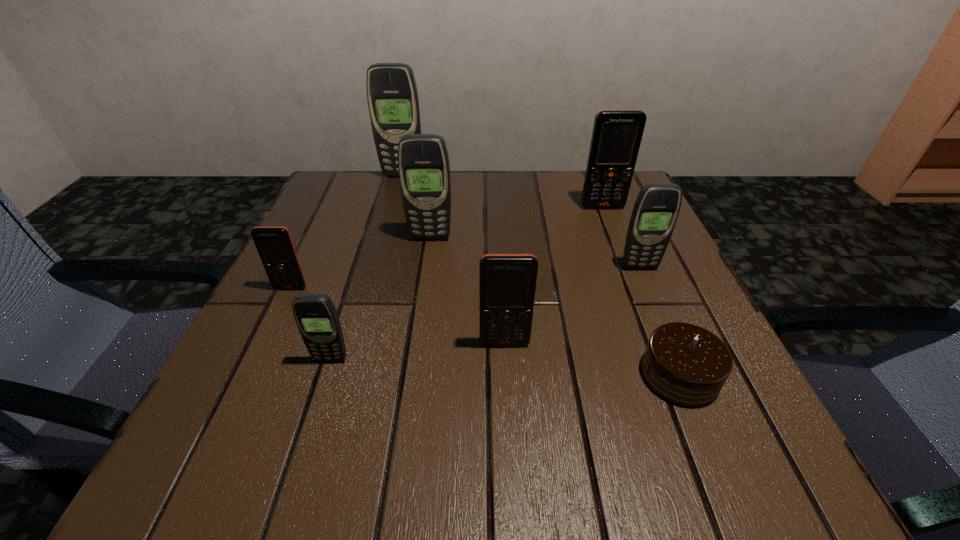
I want to click on vacant region between the third nearest gray cellular telephone and the third biggest gray cellular telephone, so click(535, 253).

You are a GUI agent. You are given a task and a screenshot of the screen. Output one action in this format:
    pyautogui.click(x=<x>, y=<y>)
    Task: Click on the vacant area that lies between the second smallest orange cellular telephone and the leftmost cellular telephone
    The image size is (960, 540).
    Given the screenshot: What is the action you would take?
    pyautogui.click(x=397, y=315)

You are a GUI agent. You are given a task and a screenshot of the screen. Output one action in this format:
    pyautogui.click(x=<x>, y=<y>)
    Task: Click on the unoccupied position between the third farthest cellular telephone and the second farthest cellular telephone
    This screenshot has height=540, width=960.
    Given the screenshot: What is the action you would take?
    pyautogui.click(x=516, y=222)

Where is `the seventh closest object to the second smallest gray cellular telephone`? the seventh closest object to the second smallest gray cellular telephone is located at coordinates (274, 245).

The image size is (960, 540). What are the coordinates of `object that is the second closest to the nearest gray cellular telephone` in the screenshot? It's located at (507, 282).

Identify which cellular telephone is located as the third nearest to the second biggest gray cellular telephone. Please provide its 2D coordinates. Your answer should be formatted as a tuple, i.e. [(x, y)], where the tuple contains the x and y coordinates of a point satisfying the conditions above.

[(507, 282)]

Find the location of a particular element. the closest cellular telephone to the second farthest object is located at coordinates (656, 209).

Point out which gray cellular telephone is positioned as the third nearest to the leftmost cellular telephone. Please provide its 2D coordinates. Your answer should be formatted as a tuple, i.e. [(x, y)], where the tuple contains the x and y coordinates of a point satisfying the conditions above.

[(392, 95)]

Image resolution: width=960 pixels, height=540 pixels. What are the coordinates of `gray cellular telephone that stands as the closest to the smallest gray cellular telephone` in the screenshot? It's located at (423, 163).

Locate an element on the screen. the second closest orange cellular telephone to the leftmost cellular telephone is located at coordinates (617, 134).